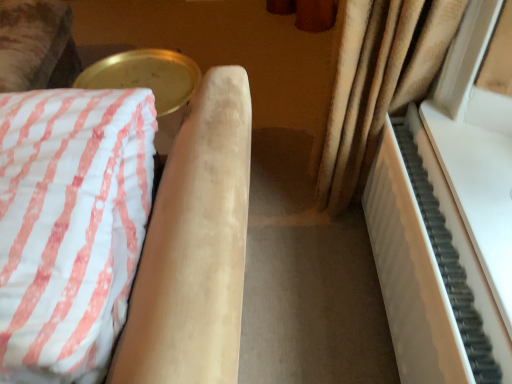
Question: Is velvet beige armchair at left at the right side of white matte piano at right?

Choices:
 (A) yes
 (B) no

Answer: (B)

Question: Is the surface of velvet beige armchair at left in direct contact with white matte piano at right?

Choices:
 (A) no
 (B) yes

Answer: (A)

Question: Can you confirm if velvet beige armchair at left is taller than white matte piano at right?

Choices:
 (A) no
 (B) yes

Answer: (B)

Question: Does velvet beige armchair at left lie in front of white matte piano at right?

Choices:
 (A) yes
 (B) no

Answer: (A)

Question: Is velvet beige armchair at left not inside white matte piano at right?

Choices:
 (A) no
 (B) yes

Answer: (B)

Question: Does velvet beige armchair at left have a lesser width compared to white matte piano at right?

Choices:
 (A) no
 (B) yes

Answer: (A)

Question: From a real-world perspective, is white matte piano at right located beneath velvet beige armchair at left?

Choices:
 (A) no
 (B) yes

Answer: (B)

Question: Is white matte piano at right shorter than velvet beige armchair at left?

Choices:
 (A) no
 (B) yes

Answer: (B)

Question: Is white matte piano at right placed right next to velvet beige armchair at left?

Choices:
 (A) yes
 (B) no

Answer: (B)

Question: Considering the relative sizes of white matte piano at right and velvet beige armchair at left in the image provided, is white matte piano at right bigger than velvet beige armchair at left?

Choices:
 (A) yes
 (B) no

Answer: (B)

Question: Is white matte piano at right far away from velvet beige armchair at left?

Choices:
 (A) no
 (B) yes

Answer: (A)

Question: Is white matte piano at right at the left side of velvet beige armchair at left?

Choices:
 (A) yes
 (B) no

Answer: (B)

Question: Relative to white matte piano at right, is velvet beige armchair at left in front or behind?

Choices:
 (A) front
 (B) behind

Answer: (A)